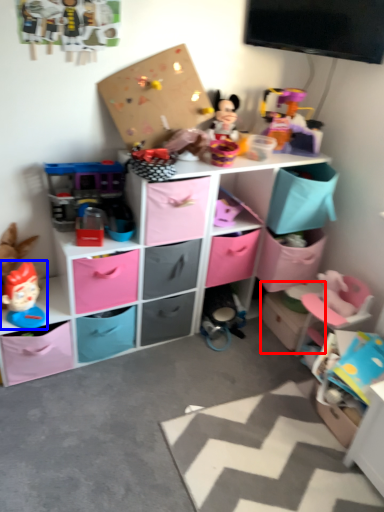
Question: Which of the following is the farthest to the observer, storage box (highlighted by a red box) or toy (highlighted by a blue box)?

Choices:
 (A) storage box
 (B) toy

Answer: (A)